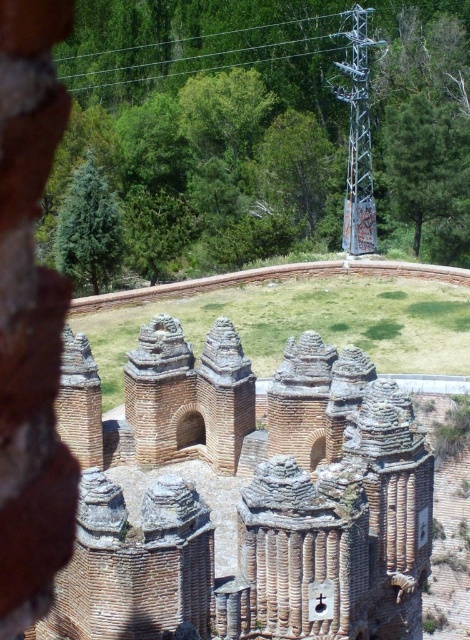
Does brown brick ruins at center have a smaller size compared to metallic/grey tower at upper right?

Incorrect, brown brick ruins at center is not smaller in size than metallic/grey tower at upper right.

Is brown brick ruins at center below metallic/grey tower at upper right?

Indeed, brown brick ruins at center is positioned under metallic/grey tower at upper right.

Identify the location of brown brick ruins at center. pyautogui.click(x=247, y=496).

The width and height of the screenshot is (470, 640). I want to click on brown brick ruins at center, so click(247, 496).

Measure the distance between brown brick ruins at center and metallic wire at upper center.

The distance of brown brick ruins at center from metallic wire at upper center is 265.33 feet.

Who is taller, brown brick ruins at center or metallic wire at upper center?

With more height is brown brick ruins at center.

Is point (67, 566) farther from viewer compared to point (289, 42)?

No, (67, 566) is closer to viewer.

Where is `brown brick ruins at center`? The height and width of the screenshot is (640, 470). brown brick ruins at center is located at coordinates (247, 496).

Between point (370, 161) and point (189, 56), which one is positioned behind?

Point (189, 56)

Is metallic/grey tower at upper right positioned behind metallic wire at upper center?

No, it is not.

Is point (355, 221) farther from viewer compared to point (366, 12)?

No, it is in front of (366, 12).

Find the location of `metallic/grey tower at upper right`. metallic/grey tower at upper right is located at coordinates (358, 134).